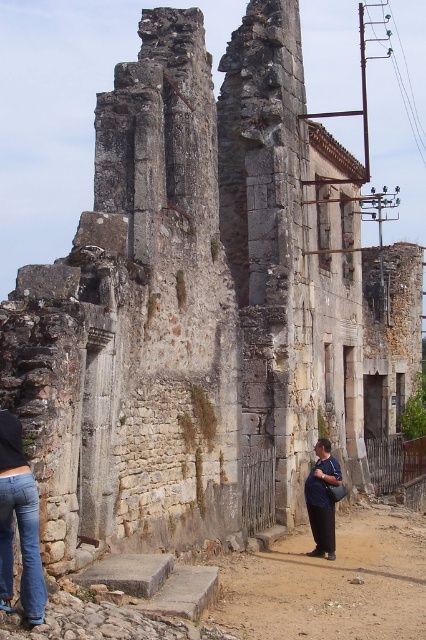
Who is more distant from viewer, (8, 426) or (330, 449)?

The point (330, 449) is more distant.

The height and width of the screenshot is (640, 426). I want to click on denim jeans at lower left, so point(19,522).

Find the location of a particular element. Image resolution: width=426 pixels, height=640 pixels. denim jeans at lower left is located at coordinates (19, 522).

Between point (412, 522) and point (39, 557), which one is positioned in front?

Point (39, 557) is more forward.

Does brown dirt path at lower center appear under denim jeans at lower left?

Yes.

Locate an element on the screen. Image resolution: width=426 pixels, height=640 pixels. brown dirt path at lower center is located at coordinates (331, 582).

Is point (353, 531) less distant than point (321, 440)?

Yes, point (353, 531) is closer to viewer.

Who is more distant from viewer, (333,616) or (317,536)?

The point (317,536) is more distant.

This screenshot has height=640, width=426. I want to click on brown dirt path at lower center, so click(x=331, y=582).